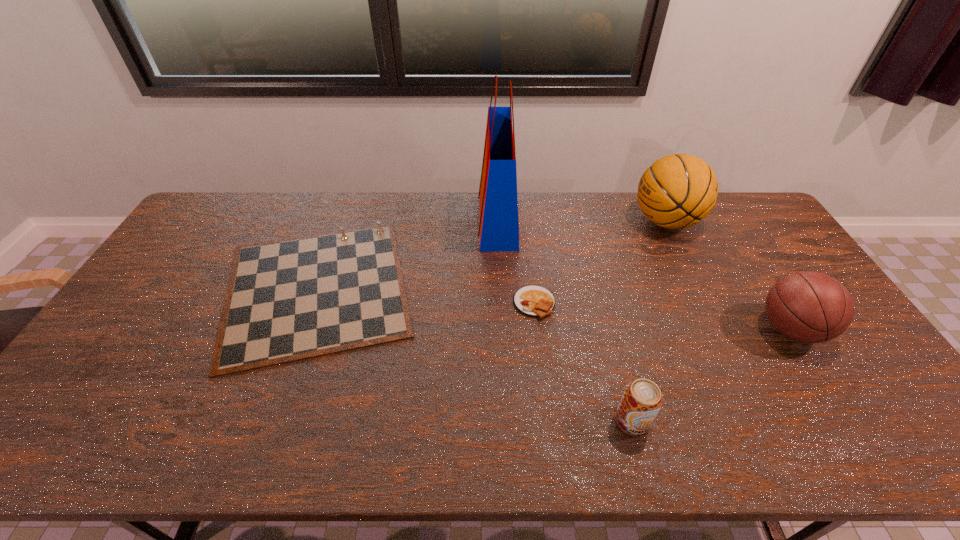
This screenshot has width=960, height=540. Identify the location of object that is the fourth nearest to the gameboard. [x=677, y=191].

You are a GUI agent. You are given a task and a screenshot of the screen. Output one action in this format:
    pyautogui.click(x=<x>, y=<y>)
    Task: Click on the vacant space that satisfies the following two spatial constraints: 1. on the surface of the fifth shortest object near the brand logo; 2. on the left side of the shorter basketball
    This screenshot has width=960, height=540.
    Given the screenshot: What is the action you would take?
    pyautogui.click(x=718, y=330)

In order to click on free space that satisfies the following two spatial constraints: 1. on the handle side of the shopping bag; 2. on the back side of the omelet in this screenshot , I will do `click(501, 303)`.